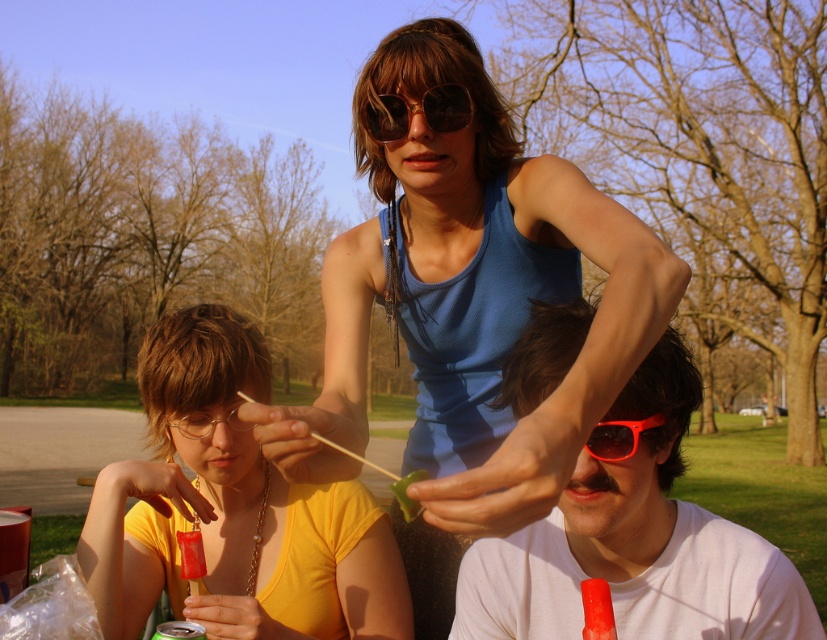
You are a photographer taking a picture of the scene. You want to ensure both the white matte shirt at lower right and the clear plastic glasses at lower left are in focus. Based on their positions, which object is closer to the camera?

The clear plastic glasses at lower left are closer to the camera because the white matte shirt at lower right is to the right of it, implying a lateral position rather than depth. However, since they are positioned side by side horizontally, their distance from the camera is likely similar.

You are standing at the origin point in the park scene. There is a white matte shirt at lower right represented by point (636, 544). Can you determine the direction of the white matte shirt at lower right from your current position?

The white matte shirt at lower right is located at coordinates (636, 544), which places it to the lower right direction from the origin point.

You are a photographer taking a picture of the sunglasses at center and the clear plastic glasses at lower left. Which object will appear larger in the photo?

The sunglasses at center will appear larger in the photo because it is closer to the viewer than the clear plastic glasses at lower left.